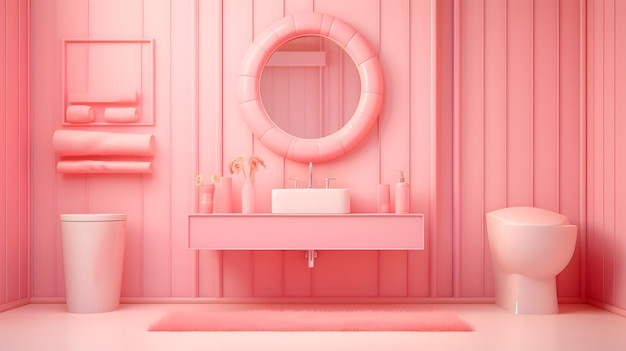
This screenshot has width=626, height=351. Identify the location of pink baseboard. (235, 296), (17, 302).